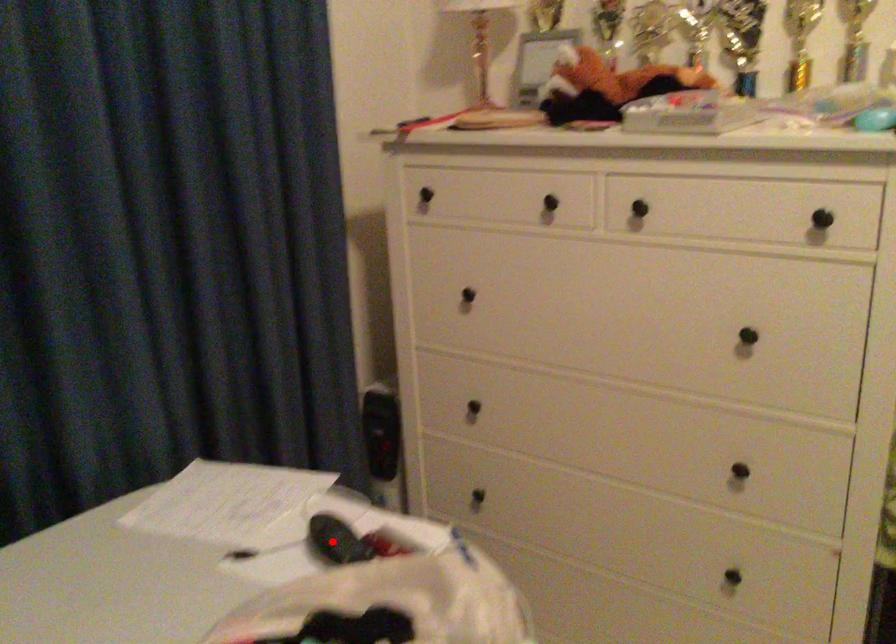
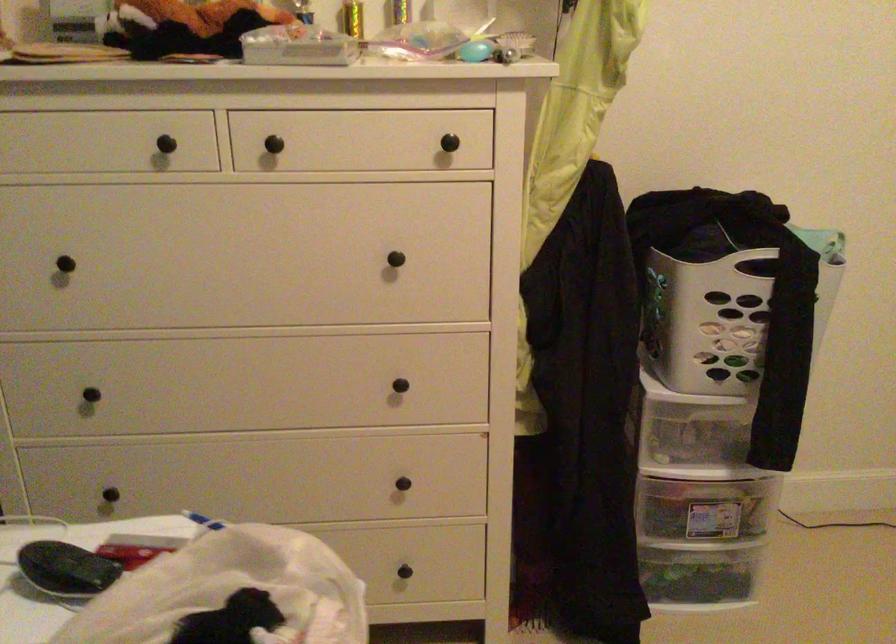
Question: I am providing you with two images of the same scene from different viewpoints. Given a red point in image1, look at the same physical point in image2. Is it:

Choices:
 (A) Closer to the viewpoint
 (B) Farther from the viewpoint

Answer: (A)